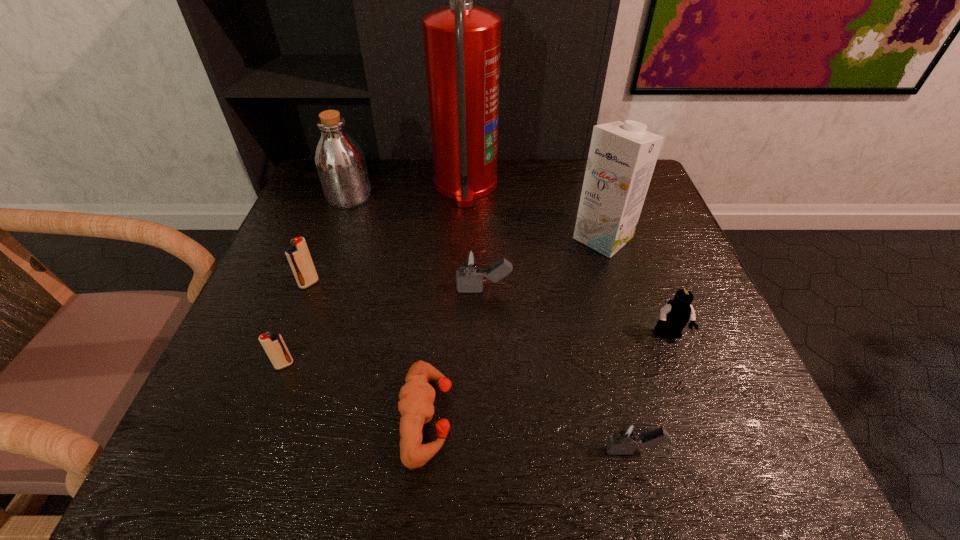
The height and width of the screenshot is (540, 960). Identify the location of unoccupied area between the farther red igniter and the farther gray igniter. (396, 287).

Identify the location of vacant area that lies between the puncher and the Lego. (548, 376).

Image resolution: width=960 pixels, height=540 pixels. Identify the location of empty space between the puncher and the bigger red igniter. (369, 350).

This screenshot has height=540, width=960. In order to click on free space between the black Lego and the smaller gray igniter in this screenshot , I will do `click(651, 393)`.

You are a GUI agent. You are given a task and a screenshot of the screen. Output one action in this format:
    pyautogui.click(x=<x>, y=<y>)
    Task: Click on the fourth closest object to the third tallest object
    This screenshot has height=540, width=960.
    Given the screenshot: What is the action you would take?
    pyautogui.click(x=274, y=345)

Choose which object is the fifth nearest neighbor to the third farthest object. Please provide its 2D coordinates. Your answer should be formatted as a tuple, i.e. [(x, y)], where the tuple contains the x and y coordinates of a point satisfying the conditions above.

[(626, 436)]

Choose which igniter is the second nearest neighbor to the left gray igniter. Please provide its 2D coordinates. Your answer should be formatted as a tuple, i.e. [(x, y)], where the tuple contains the x and y coordinates of a point satisfying the conditions above.

[(626, 436)]

Select which igniter is the closest to the eighth shortest object. Please provide its 2D coordinates. Your answer should be formatted as a tuple, i.e. [(x, y)], where the tuple contains the x and y coordinates of a point satisfying the conditions above.

[(470, 268)]

Find the location of a particular element. This screenshot has width=960, height=540. free space that satisfies the following two spatial constraints: 1. on the back side of the bigger red igniter; 2. on the right side of the bottle is located at coordinates (342, 197).